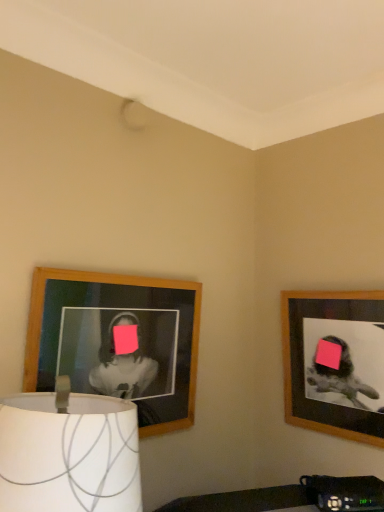
Question: Is white fabric lampshade at lower left surrounded by wooden frame at upper right, the 1th picture frame positioned from the right?

Choices:
 (A) no
 (B) yes

Answer: (A)

Question: Is wooden frame at upper right, the 1th picture frame positioned from the right, facing away from white fabric lampshade at lower left?

Choices:
 (A) no
 (B) yes

Answer: (A)

Question: From the image's perspective, would you say wooden frame at upper right, the 1th picture frame positioned from the right, is positioned over white fabric lampshade at lower left?

Choices:
 (A) yes
 (B) no

Answer: (A)

Question: Does wooden frame at upper right, which is the second picture frame from left to right, have a lesser height compared to white fabric lampshade at lower left?

Choices:
 (A) yes
 (B) no

Answer: (B)

Question: Does wooden frame at upper right, which is the second picture frame from left to right, have a lesser width compared to white fabric lampshade at lower left?

Choices:
 (A) yes
 (B) no

Answer: (A)

Question: Does wooden frame at upper right, the 1th picture frame positioned from the right, appear on the right side of white fabric lampshade at lower left?

Choices:
 (A) yes
 (B) no

Answer: (A)

Question: Is white fabric lampshade at lower left to the left of wooden picture frame at left, which is the first picture frame from left to right, from the viewer's perspective?

Choices:
 (A) yes
 (B) no

Answer: (A)

Question: Does white fabric lampshade at lower left turn towards wooden picture frame at left, which is the first picture frame from left to right?

Choices:
 (A) no
 (B) yes

Answer: (A)

Question: Considering the relative sizes of white fabric lampshade at lower left and wooden picture frame at left, arranged as the 2th picture frame when viewed from the right, in the image provided, is white fabric lampshade at lower left thinner than wooden picture frame at left, arranged as the 2th picture frame when viewed from the right,?

Choices:
 (A) yes
 (B) no

Answer: (B)

Question: From a real-world perspective, is white fabric lampshade at lower left on wooden picture frame at left, which is the first picture frame from left to right?

Choices:
 (A) no
 (B) yes

Answer: (A)

Question: Is white fabric lampshade at lower left shorter than wooden picture frame at left, arranged as the 2th picture frame when viewed from the right?

Choices:
 (A) yes
 (B) no

Answer: (A)

Question: Does white fabric lampshade at lower left have a smaller size compared to wooden picture frame at left, which is the first picture frame from left to right?

Choices:
 (A) no
 (B) yes

Answer: (A)

Question: Is white fabric lampshade at lower left taller than wooden frame at upper right, the 1th picture frame positioned from the right?

Choices:
 (A) no
 (B) yes

Answer: (A)